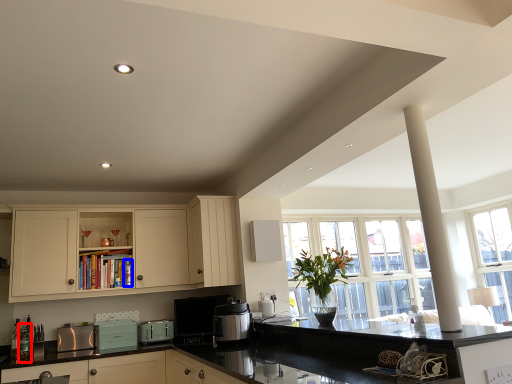
Question: Which object is closer to the camera taking this photo, bottle (highlighted by a red box) or bottle (highlighted by a blue box)?

Choices:
 (A) bottle
 (B) bottle

Answer: (A)